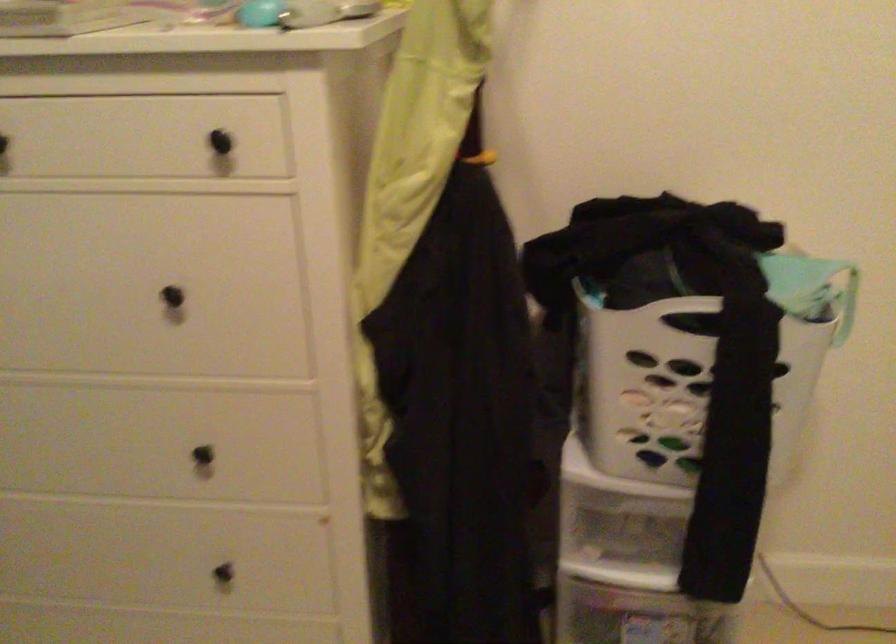
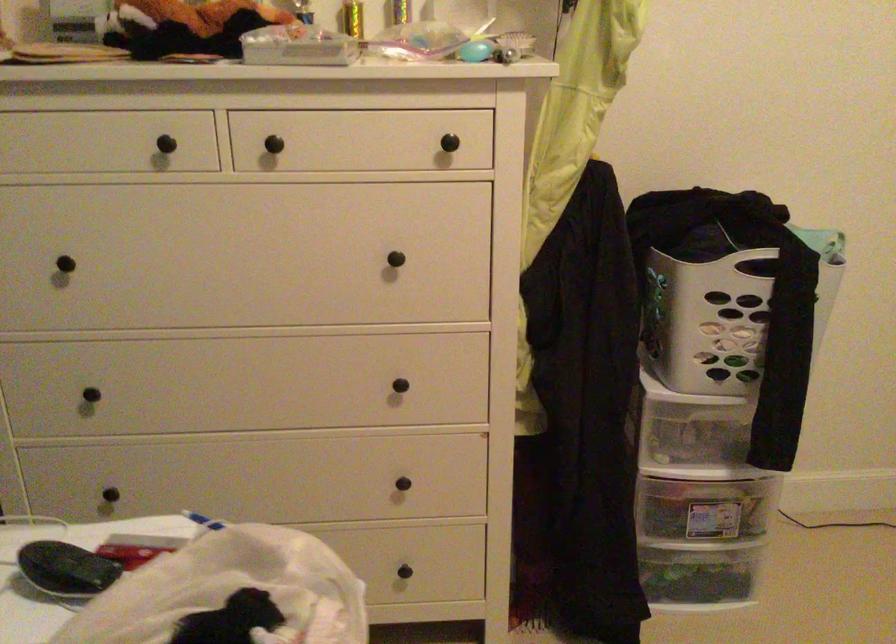
In a continuous first-person perspective shot, in which direction is the camera moving?

The movement direction of the cameraman is left, backward.